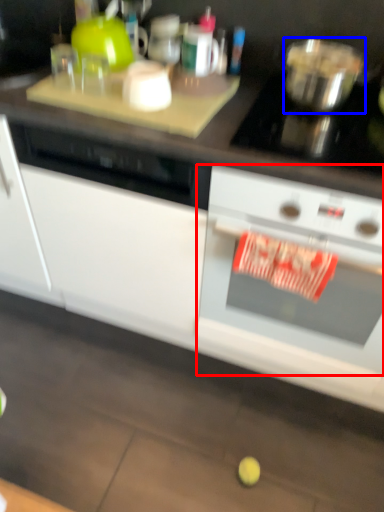
Question: Which of the following is the closest to the observer, kitchen appliance (highlighted by a red box) or bowl (highlighted by a blue box)?

Choices:
 (A) kitchen appliance
 (B) bowl

Answer: (A)